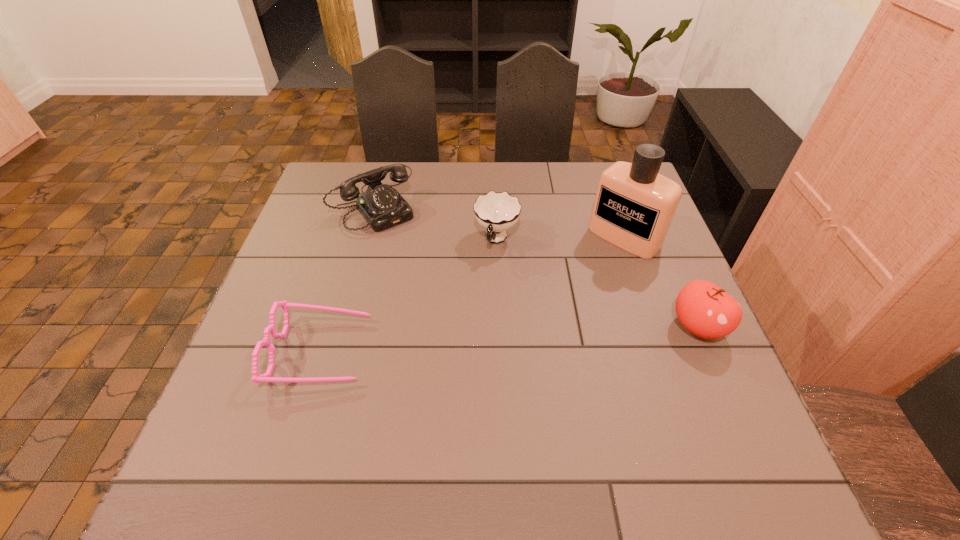
Where is `spectacles`? spectacles is located at coordinates (266, 377).

Find the location of a particular element. Image resolution: width=960 pixels, height=540 pixels. apple is located at coordinates (704, 309).

Where is `perfume`? The width and height of the screenshot is (960, 540). perfume is located at coordinates (634, 206).

The image size is (960, 540). What are the coordinates of `the third object from right to left` in the screenshot? It's located at (497, 212).

You are a GUI agent. You are given a task and a screenshot of the screen. Output one action in this format:
    pyautogui.click(x=<x>, y=<y>)
    Task: Click on the telephone
    The image size is (960, 540).
    Given the screenshot: What is the action you would take?
    pyautogui.click(x=382, y=206)

Identify the location of blank area located 0.050m on the arms of the spectacles. This screenshot has width=960, height=540. (390, 351).

Where is `free space located on the left of the apple`? Image resolution: width=960 pixels, height=540 pixels. free space located on the left of the apple is located at coordinates (540, 327).

Where is `free region located 0.330m on the front label of the perfume`? free region located 0.330m on the front label of the perfume is located at coordinates (528, 328).

At what (x,y) coordinates should I click in order to perform the action: click on free space located on the front label of the perfume. Please return your answer as a coordinate pair (x, y). Looking at the image, I should click on (555, 303).

Identify the location of vacant region located on the front label of the perfume. tap(594, 266).